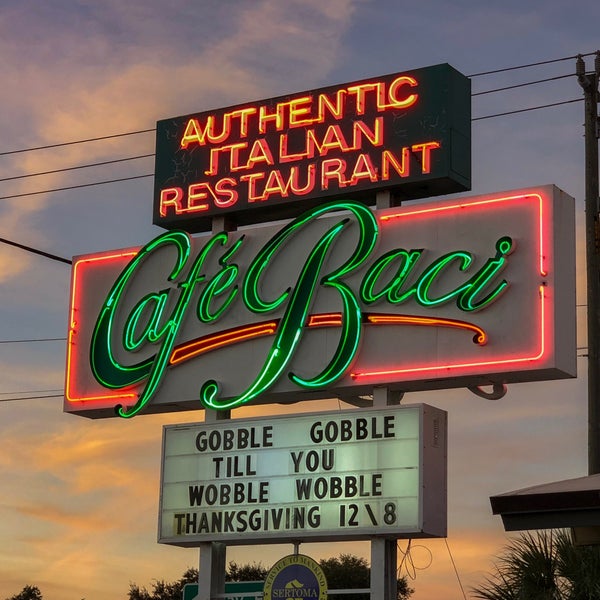
You are a GUI agent. You are given a task and a screenshot of the screen. Output one action in this format:
    pyautogui.click(x=<x>, y=<y>)
    Task: Click on the box
    
    Given the screenshot: What is the action you would take?
    pyautogui.click(x=444, y=127), pyautogui.click(x=565, y=262), pyautogui.click(x=434, y=464)